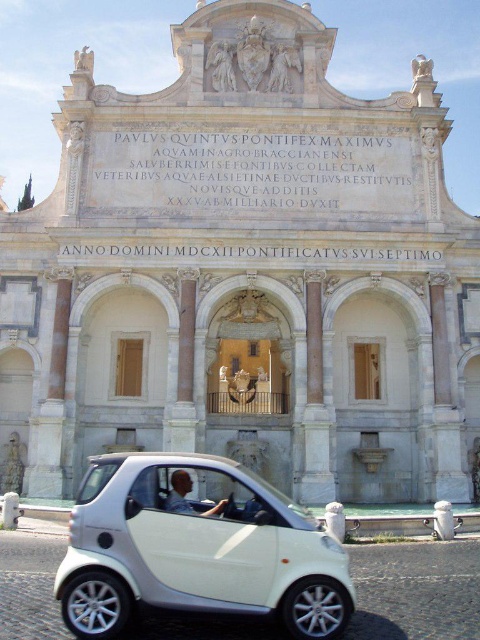
You are a tour guide leading a group to the historical fountain. You see a white matte car at lower center and a light blue shirt at center. Which object is closer to the group?

The white matte car at lower center is closer to the group because it is in front of the light blue shirt at center.

You are a photographer standing at the base of the grand structure. You want to capture both the white matte car at lower center and the light blue shirt at center in a single photo. Based on their positions, which object should you frame first to ensure both are in the shot?

You should frame the white matte car at lower center first since it is to the left of the light blue shirt at center, ensuring both are included in the photo.

You are a photographer standing at the base of the grand structure. You want to take a photo of the white matte car at lower center so that it appears in the foreground with the monument in the background. Given that the car is 43.26 meters away from your position, will you need to adjust your camera settings to focus on both the car and the distant monument simultaneously?

The white matte car at lower center is 43.26 meters from the camera. To capture both the car in the foreground and the distant monument in focus, you would need to use a small aperture setting to increase the depth of field, ensuring both subjects are sharp.